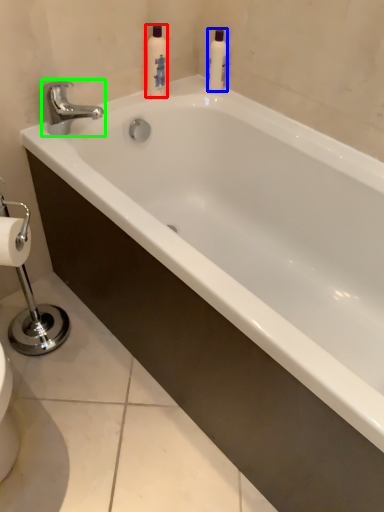
Question: Which object is the farthest from cleaning product (highlighted by a red box)? Choose among these: cleaning product (highlighted by a blue box) or tap (highlighted by a green box).

Choices:
 (A) cleaning product
 (B) tap

Answer: (B)